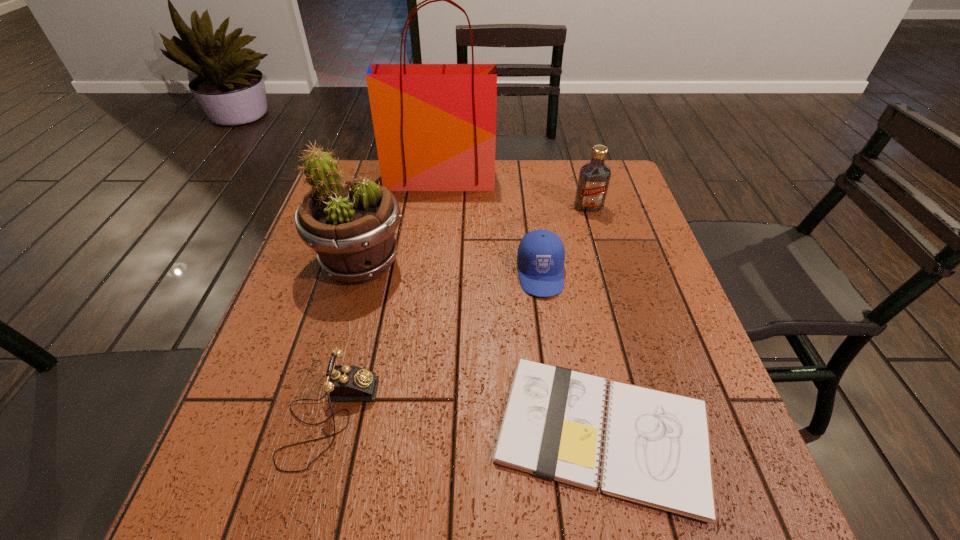
Identify which object is located as the fifth nearest to the vodka. Please provide its 2D coordinates. Your answer should be formatted as a tuple, i.e. [(x, y)], where the tuple contains the x and y coordinates of a point satisfying the conditions above.

[(344, 382)]

This screenshot has height=540, width=960. What are the coordinates of `the fifth closest object to the cap` in the screenshot? It's located at (344, 382).

What are the coordinates of `free space that satisfies the following two spatial constraints: 1. on the front-facing side of the cap; 2. on the right side of the notepad` in the screenshot? It's located at pyautogui.click(x=563, y=433).

Locate an element on the screen. free space that satisfies the following two spatial constraints: 1. on the dial of the telephone; 2. on the left side of the notepad is located at coordinates (325, 433).

Image resolution: width=960 pixels, height=540 pixels. Find the location of `free space that satisfies the following two spatial constraints: 1. on the handle side of the farthest object; 2. on the dial of the telephone`. free space that satisfies the following two spatial constraints: 1. on the handle side of the farthest object; 2. on the dial of the telephone is located at coordinates (413, 417).

This screenshot has width=960, height=540. In order to click on free space that satisfies the following two spatial constraints: 1. on the dial of the shortest object; 2. on the left side of the telephone in this screenshot , I will do `click(325, 433)`.

Identify the location of vacant space that satisfies the following two spatial constraints: 1. on the back side of the shortest object; 2. on the dial of the telephone. The width and height of the screenshot is (960, 540). (600, 417).

Locate an element on the screen. Image resolution: width=960 pixels, height=540 pixels. free space in the image that satisfies the following two spatial constraints: 1. on the front-facing side of the shortest object; 2. on the right side of the cap is located at coordinates (563, 433).

The image size is (960, 540). Identify the location of free space that satisfies the following two spatial constraints: 1. on the handle side of the shortest object; 2. on the right side of the shopping bag. (411, 433).

Image resolution: width=960 pixels, height=540 pixels. In order to click on vacant space that satisfies the following two spatial constraints: 1. on the front-facing side of the vodka; 2. on the dial of the telephone in this screenshot , I will do `click(650, 417)`.